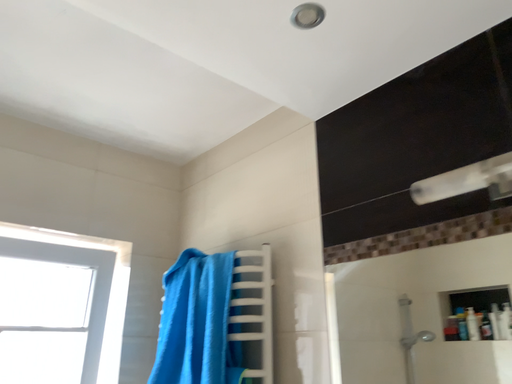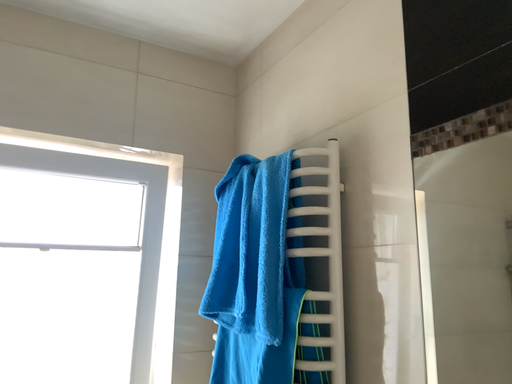
Question: Which way did the camera rotate in the video?

Choices:
 (A) rotated upward
 (B) rotated downward

Answer: (B)